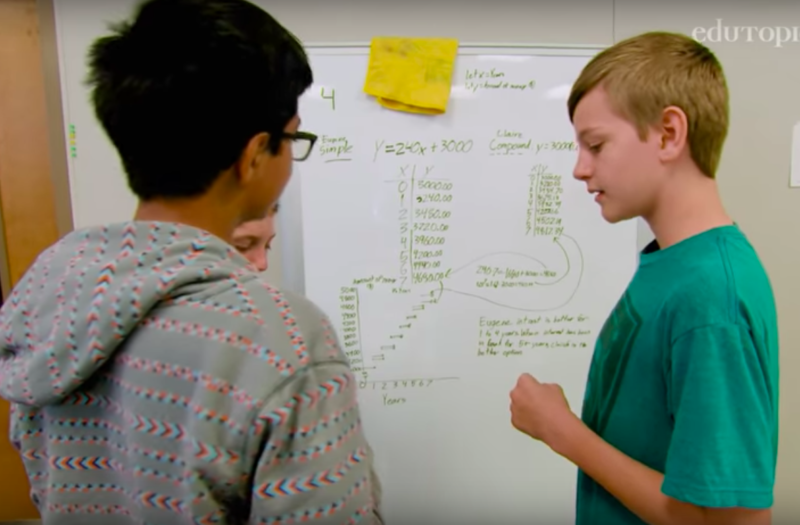
The width and height of the screenshot is (800, 525). In order to click on yellow rag in this screenshot , I will do `click(409, 97)`.